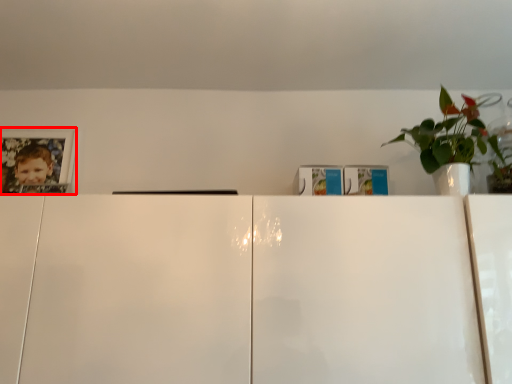
Question: Observing the image, what is the correct spatial positioning of picture frame (annotated by the red box) in reference to houseplant?

Choices:
 (A) right
 (B) left

Answer: (B)